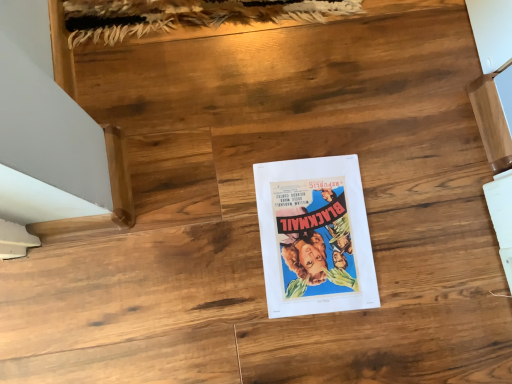
Find the location of `vacant region above white paper poster at center (from a real-world perspective)`. vacant region above white paper poster at center (from a real-world perspective) is located at coordinates (313, 236).